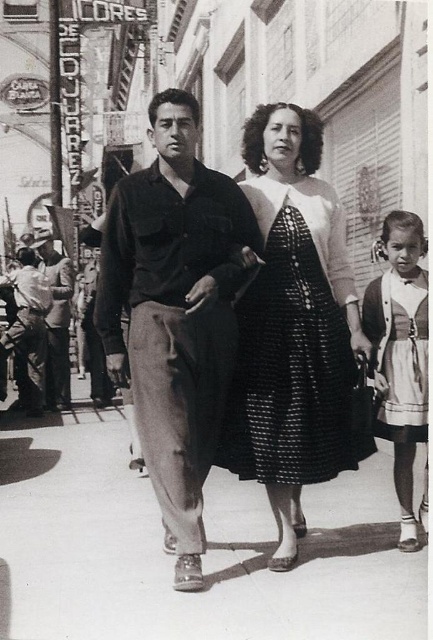
Question: Which of the following is the closest to the observer?

Choices:
 (A) smooth black shirt at center
 (B) smooth leather jacket at left

Answer: (A)

Question: Can you confirm if smooth concrete pavement at center is positioned to the left of white cotton dirndl at right?

Choices:
 (A) yes
 (B) no

Answer: (A)

Question: Is white cotton dress at lower right below white cotton dirndl at right?

Choices:
 (A) no
 (B) yes

Answer: (A)

Question: Estimate the real-world distances between objects in this image. Which object is closer to the smooth leather jacket at left?

Choices:
 (A) black sequined dress at center
 (B) white cotton dress at lower right

Answer: (A)

Question: Which object is the farthest from the white cotton dress at lower right?

Choices:
 (A) smooth leather jacket at left
 (B) white cotton dirndl at right
 (C) black sequined dress at center
 (D) smooth black shirt at center

Answer: (A)

Question: Is black sequined dress at center above matte black jacket at left?

Choices:
 (A) no
 (B) yes

Answer: (A)